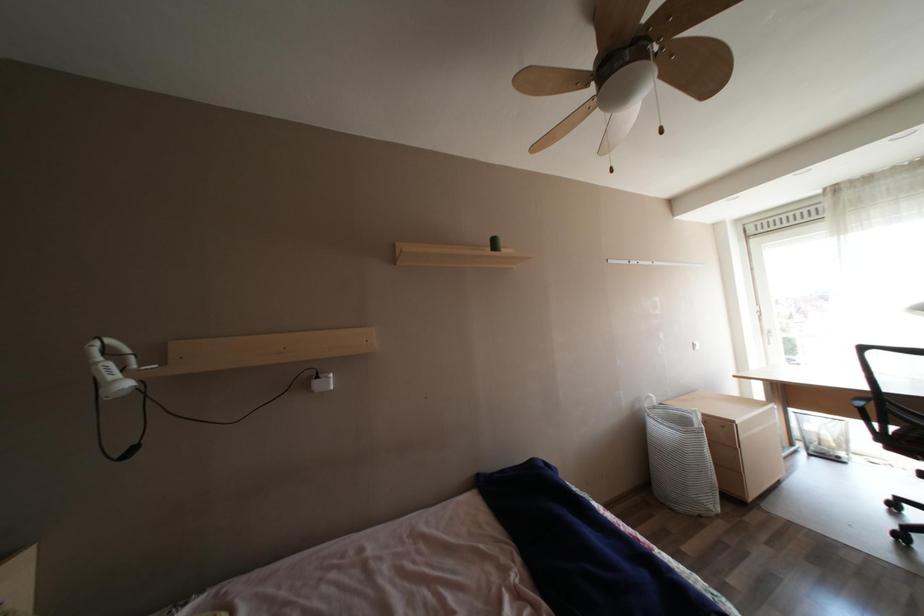
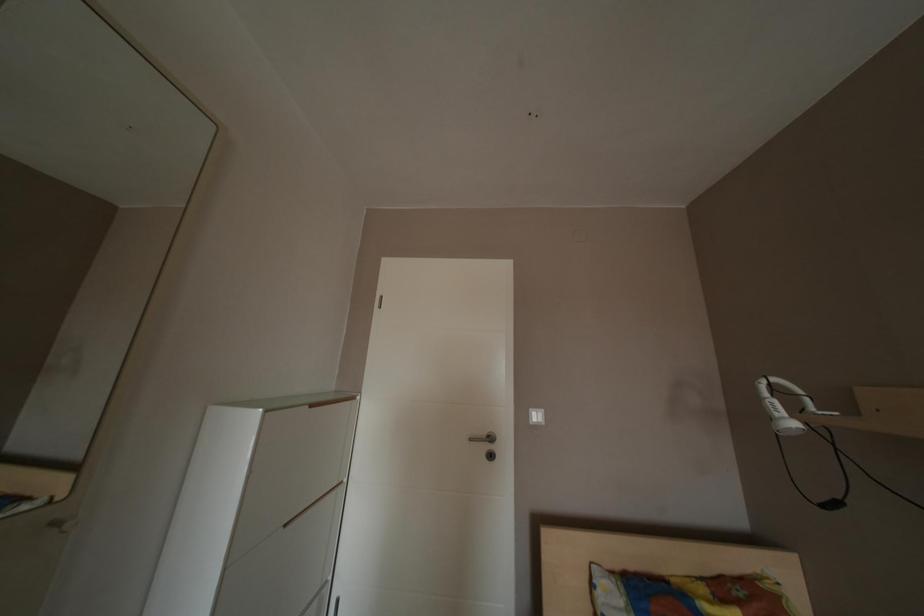
Question: Based on the continuous images, in which direction is the camera rotating? Reply with the corresponding letter.

Choices:
 (A) Left
 (B) Right
 (C) Up
 (D) Down

Answer: (A)